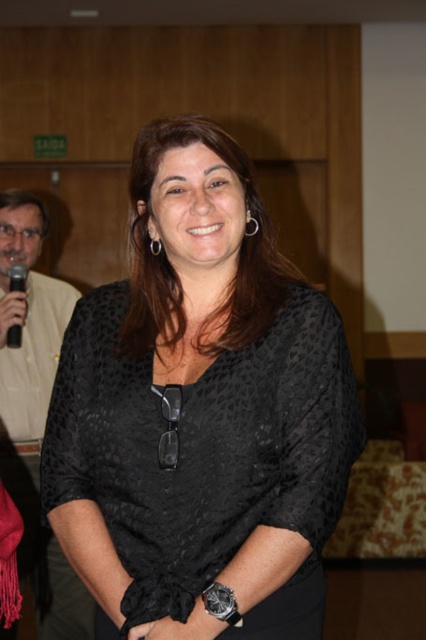
You are an event planner setting up a camera for a photo shoot in the described scene. The camera needs to focus on the matte beige shirt at left. Where should you position the camera to capture the shirt in the frame?

The matte beige shirt at left is located at the 2D coordinates point (x=34, y=410), so position the camera to aim at that point to capture the shirt in the frame.

You are organizing a clothing display and need to arrange the black dotted blouse at center and the matte beige shirt at left based on their sizes. Which one should be placed first in a size ascending order?

The black dotted blouse at center has a smaller size compared to matte beige shirt at left, so it should be placed first in a size ascending order.